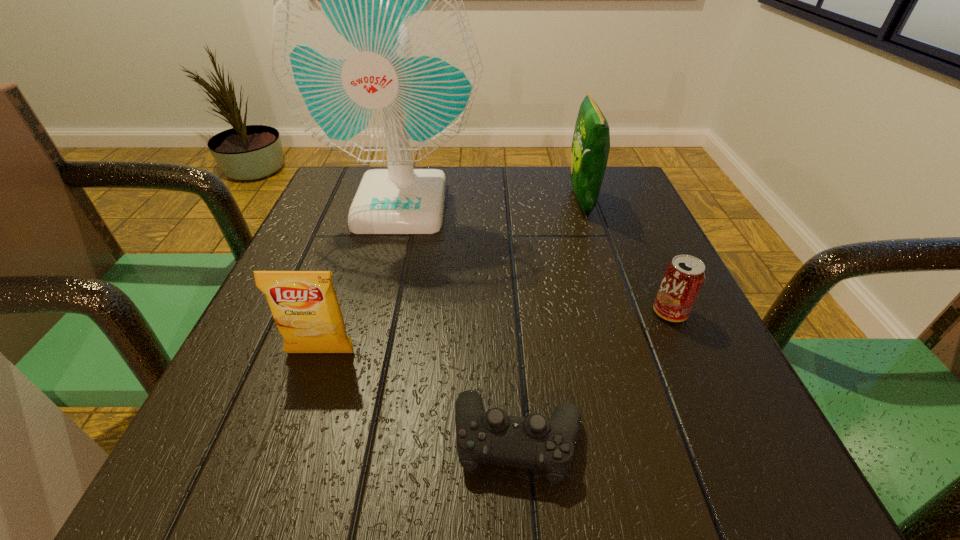
Where is `vacant space located on the front-facing side of the taller crisp (potato chip)`? This screenshot has width=960, height=540. vacant space located on the front-facing side of the taller crisp (potato chip) is located at coordinates (502, 201).

Where is `vacant space situated on the front-facing side of the taller crisp (potato chip)`? Image resolution: width=960 pixels, height=540 pixels. vacant space situated on the front-facing side of the taller crisp (potato chip) is located at coordinates (541, 201).

The height and width of the screenshot is (540, 960). What are the coordinates of `vacant space situated 0.230m on the front-facing side of the taller crisp (potato chip)` in the screenshot? It's located at (467, 201).

You are a GUI agent. You are given a task and a screenshot of the screen. Output one action in this format:
    pyautogui.click(x=<x>, y=<y>)
    Task: Click on the free space located on the front of the left crisp (potato chip) with the logo
    The image size is (960, 540).
    Given the screenshot: What is the action you would take?
    pyautogui.click(x=306, y=397)

Image resolution: width=960 pixels, height=540 pixels. In order to click on vacant space positioned 0.360m on the back of the third nearest object in this screenshot , I will do `click(616, 193)`.

This screenshot has width=960, height=540. I want to click on free space located 0.070m on the right of the control, so click(636, 440).

Find the location of a particular element. The width and height of the screenshot is (960, 540). fan at the far edge is located at coordinates (372, 49).

Find the location of a particular element. crisp (potato chip) present at the far edge is located at coordinates (591, 141).

Locate an element on the screen. The height and width of the screenshot is (540, 960). object that is at the near edge is located at coordinates (534, 442).

You are a GUI agent. You are given a task and a screenshot of the screen. Output one action in this format:
    pyautogui.click(x=<x>, y=<y>)
    Task: Click on the fan present at the left edge
    
    Given the screenshot: What is the action you would take?
    pyautogui.click(x=372, y=49)